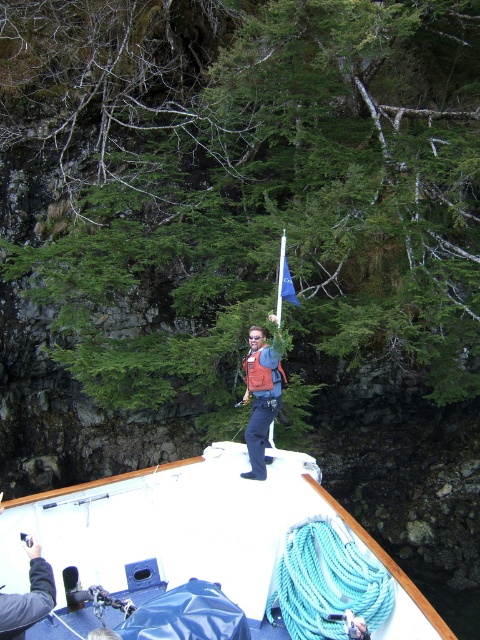
Question: Is white matte boat at center wider than orange life vest at center?

Choices:
 (A) yes
 (B) no

Answer: (A)

Question: Can you confirm if white matte boat at center is positioned to the right of orange life vest at center?

Choices:
 (A) no
 (B) yes

Answer: (A)

Question: Among these points, which one is nearest to the camera?

Choices:
 (A) (271, 365)
 (B) (398, 616)

Answer: (B)

Question: Among these objects, which one is farthest from the camera?

Choices:
 (A) orange life vest at center
 (B) white matte boat at center

Answer: (A)

Question: Does white matte boat at center have a larger size compared to orange life vest at center?

Choices:
 (A) no
 (B) yes

Answer: (B)